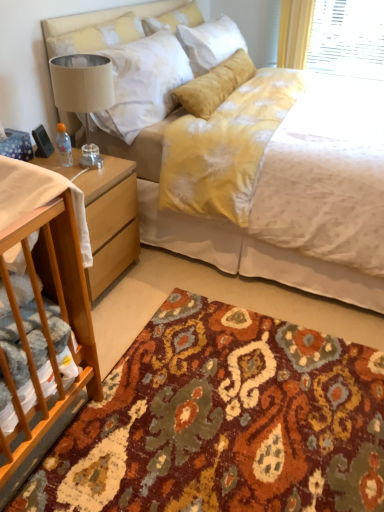
Identify the location of free spot above multicolored woven rug at lower center (from a real-world perspective). This screenshot has height=512, width=384. (212, 379).